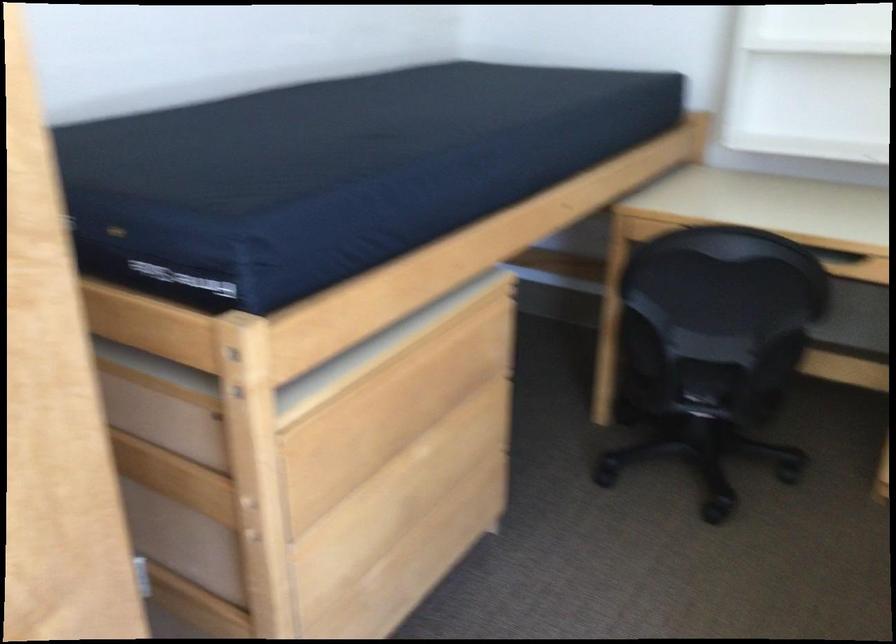
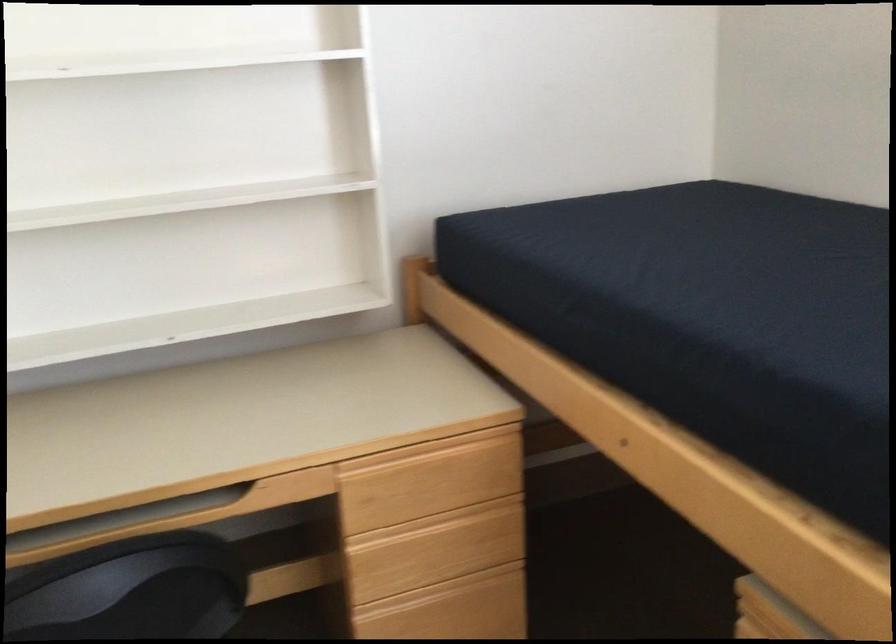
Question: The camera is either moving clockwise (left) or counter-clockwise (right) around the object. The first image is from the beginning of the video and the second image is from the end. Is the camera moving left or right when shooting the video?

Choices:
 (A) Left
 (B) Right

Answer: (A)